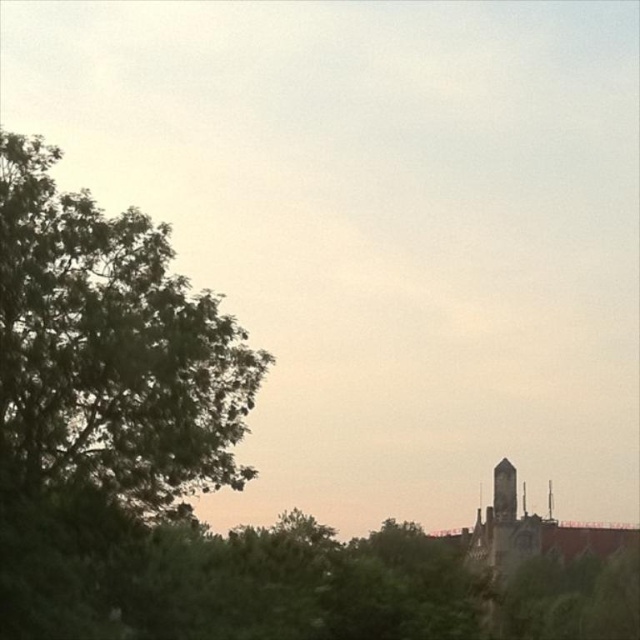
Question: Is green leafy tree at left behind smooth stone tower at right?

Choices:
 (A) yes
 (B) no

Answer: (B)

Question: Among these objects, which one is farthest from the camera?

Choices:
 (A) smooth stone spire at upper right
 (B) green leafy tree at left

Answer: (A)

Question: Is smooth gray spire at upper right positioned behind smooth stone spire at upper right?

Choices:
 (A) no
 (B) yes

Answer: (B)

Question: Is green leafy tree at left closer to camera compared to smooth stone spire at upper right?

Choices:
 (A) yes
 (B) no

Answer: (A)

Question: Which object is the farthest from the smooth stone tower at right?

Choices:
 (A) green leafy tree at left
 (B) smooth stone spire at upper right
 (C) smooth gray spire at upper right

Answer: (A)

Question: Among these objects, which one is farthest from the camera?

Choices:
 (A) smooth gray spire at upper right
 (B) dark gray stone tower at right
 (C) smooth stone spire at upper right

Answer: (A)